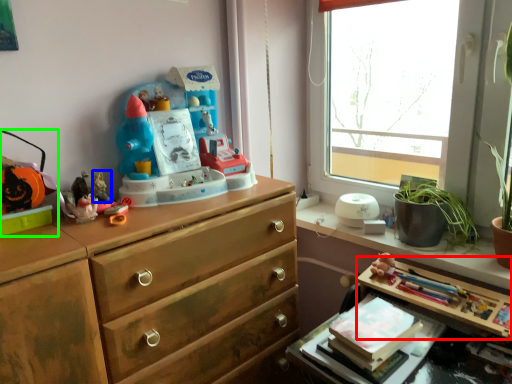
Question: Based on their relative distances, which object is farther from table (highlighted by a red box)? Choose from toy (highlighted by a blue box) and toy (highlighted by a green box).

Choices:
 (A) toy
 (B) toy

Answer: (B)